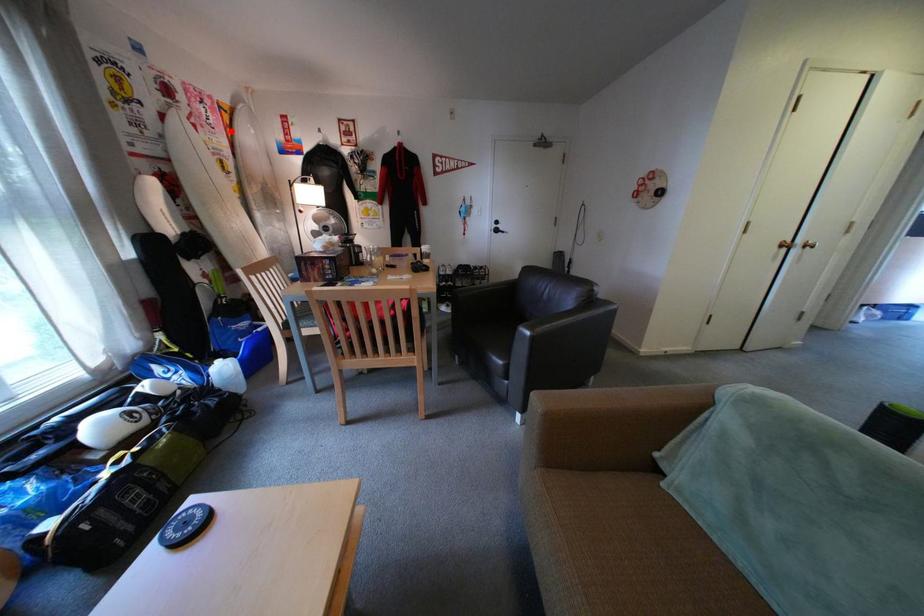
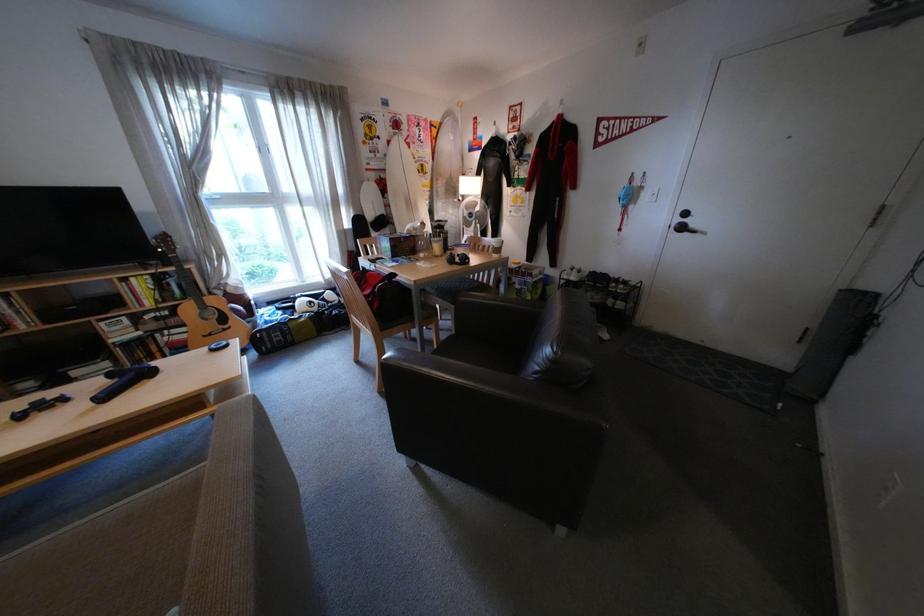
Locate, in the second image, the point that corresponds to the highlighted location in the first image.

(439, 145)